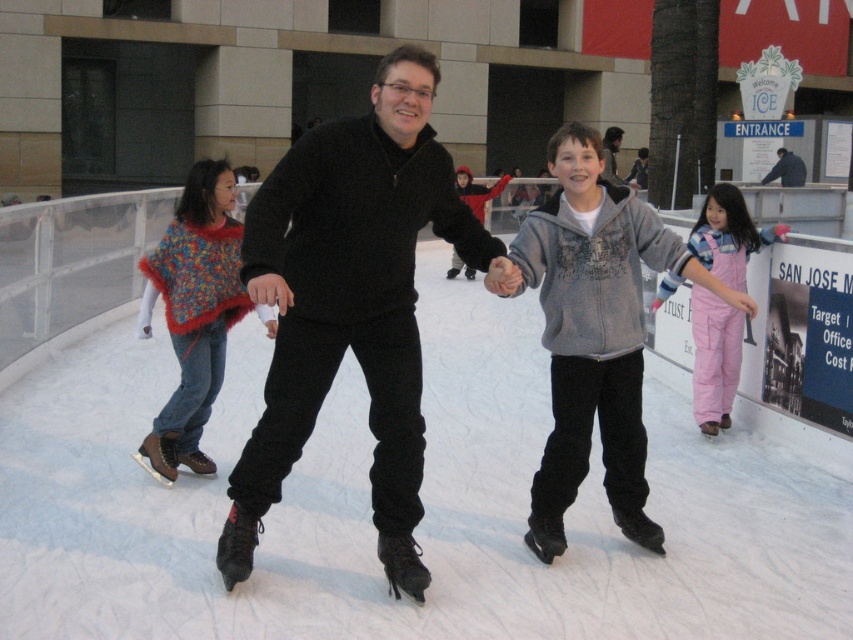
Question: Does black matte sweater at center appear on the left side of knitted multicolored shawl at left?

Choices:
 (A) yes
 (B) no

Answer: (B)

Question: Which point appears farthest from the camera in this image?

Choices:
 (A) (149, 282)
 (B) (793, 177)
 (C) (738, 378)
 (D) (569, 148)

Answer: (B)

Question: In this image, where is gray fleece jacket at center located relative to dark gray jacket at center?

Choices:
 (A) above
 (B) below

Answer: (B)

Question: Which point appears closest to the camera in this image?

Choices:
 (A) (297, 227)
 (B) (735, 625)

Answer: (B)

Question: Estimate the real-world distances between objects in this image. Which object is farther from the dark gray jacket at center?

Choices:
 (A) white ice skating rink at center
 (B) black matte sweater at center
 (C) pink cotton overalls at lower right

Answer: (B)

Question: Is knitted multicolored shawl at left smaller than pink cotton overalls at lower right?

Choices:
 (A) no
 (B) yes

Answer: (B)